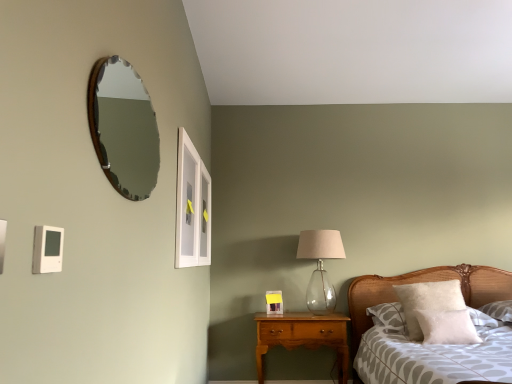
Question: Is white fluffy pillow at right, marked as the 2th pillow in a front-to-back arrangement, to the right of patterned fabric bed at lower right from the viewer's perspective?

Choices:
 (A) no
 (B) yes

Answer: (A)

Question: Can you confirm if white fluffy pillow at right, marked as the 2th pillow in a front-to-back arrangement, is smaller than patterned fabric bed at lower right?

Choices:
 (A) no
 (B) yes

Answer: (B)

Question: Is the surface of white fluffy pillow at right, marked as the 2th pillow in a front-to-back arrangement, in direct contact with patterned fabric bed at lower right?

Choices:
 (A) yes
 (B) no

Answer: (B)

Question: Does white fluffy pillow at right, placed as the first pillow when sorted from back to front, appear on the left side of patterned fabric bed at lower right?

Choices:
 (A) no
 (B) yes

Answer: (B)

Question: From the image's perspective, is white fluffy pillow at right, placed as the first pillow when sorted from back to front, located beneath patterned fabric bed at lower right?

Choices:
 (A) yes
 (B) no

Answer: (B)

Question: Are white fluffy pillow at right, placed as the first pillow when sorted from back to front, and patterned fabric bed at lower right far apart?

Choices:
 (A) yes
 (B) no

Answer: (B)

Question: Can you confirm if patterned fabric bed at lower right is bigger than wooden-framed mirror at upper left?

Choices:
 (A) no
 (B) yes

Answer: (B)

Question: Is patterned fabric bed at lower right at the left side of wooden-framed mirror at upper left?

Choices:
 (A) no
 (B) yes

Answer: (A)

Question: Is wooden-framed mirror at upper left located within patterned fabric bed at lower right?

Choices:
 (A) no
 (B) yes

Answer: (A)

Question: Is patterned fabric bed at lower right not near wooden-framed mirror at upper left?

Choices:
 (A) yes
 (B) no

Answer: (A)

Question: From a real-world perspective, is patterned fabric bed at lower right under wooden-framed mirror at upper left?

Choices:
 (A) yes
 (B) no

Answer: (A)

Question: Can you confirm if patterned fabric bed at lower right is thinner than wooden-framed mirror at upper left?

Choices:
 (A) yes
 (B) no

Answer: (B)

Question: From the image's perspective, is wooden-framed mirror at upper left on top of clear glass window at upper center?

Choices:
 (A) yes
 (B) no

Answer: (A)